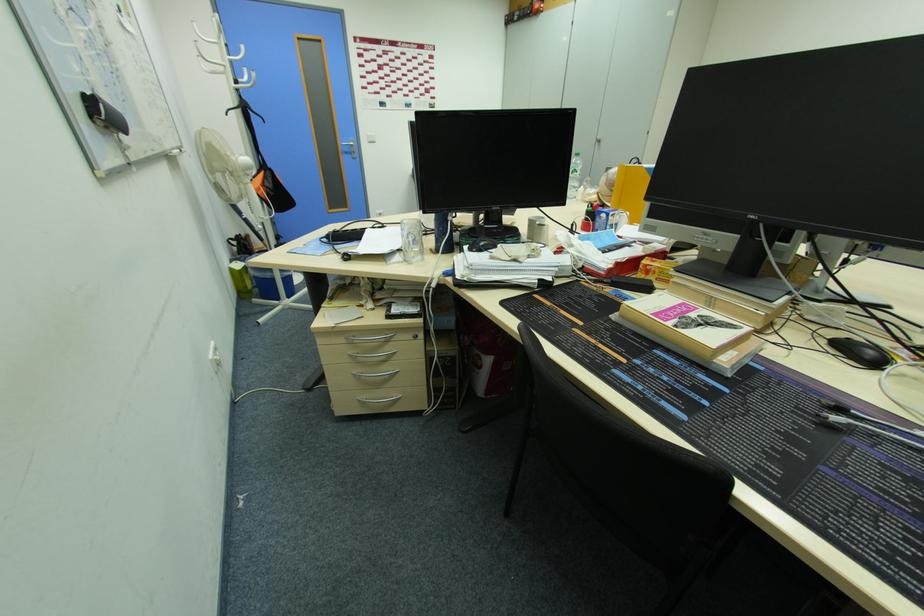
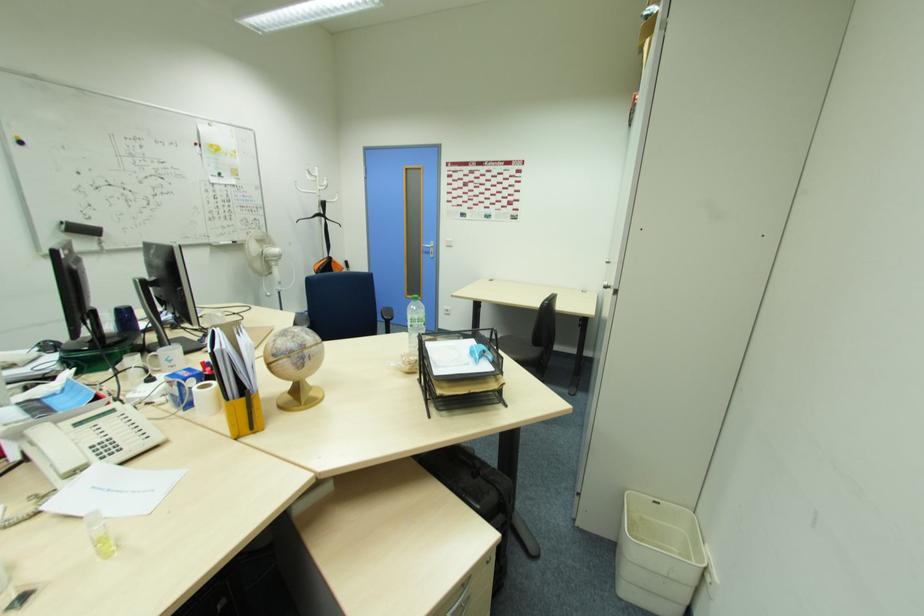
In the second image, find the point that corresponds to the point at 349,151 in the first image.

(430, 252)